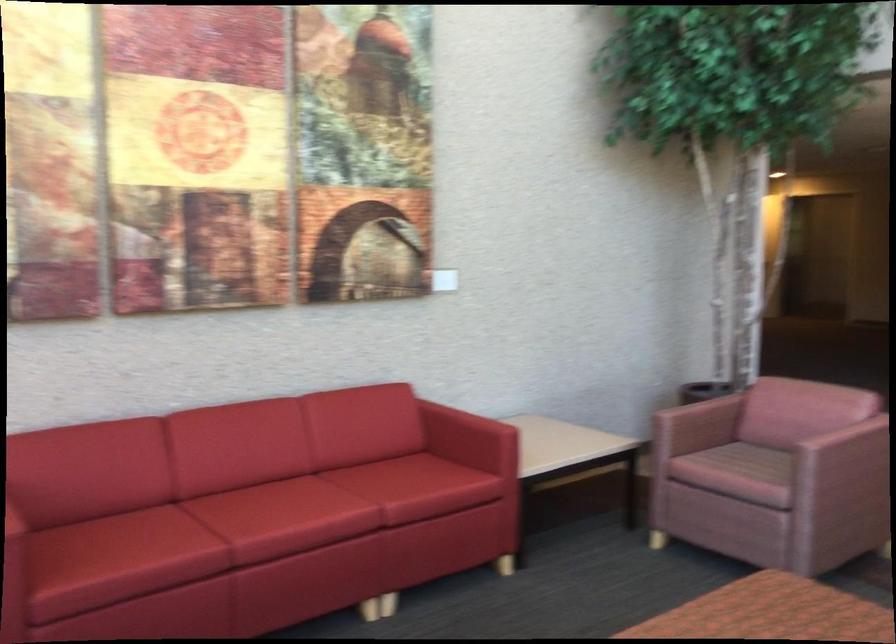
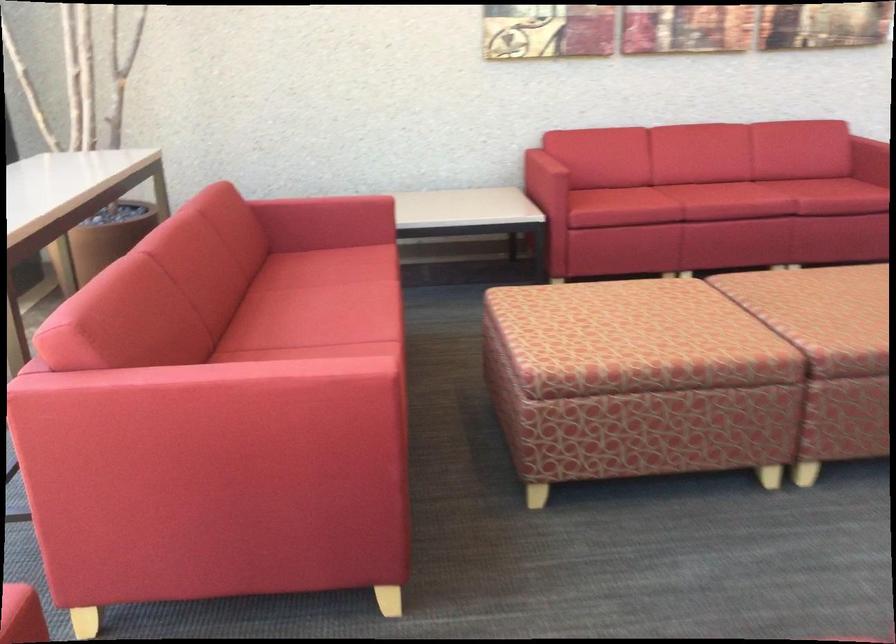
In the second image, find the point that corresponds to (297,541) in the first image.

(725, 201)